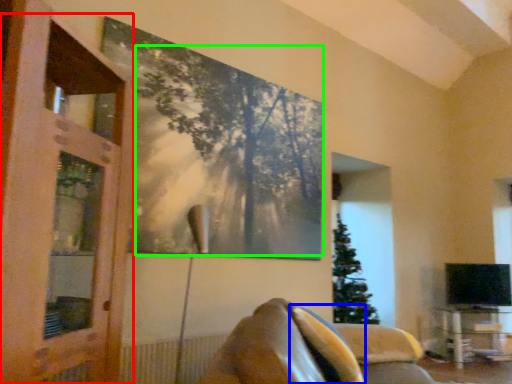
Question: Based on their relative distances, which object is farther from screen door (highlighted by a red box)? Choose from pillow (highlighted by a blue box) and tree (highlighted by a green box).

Choices:
 (A) pillow
 (B) tree

Answer: (A)